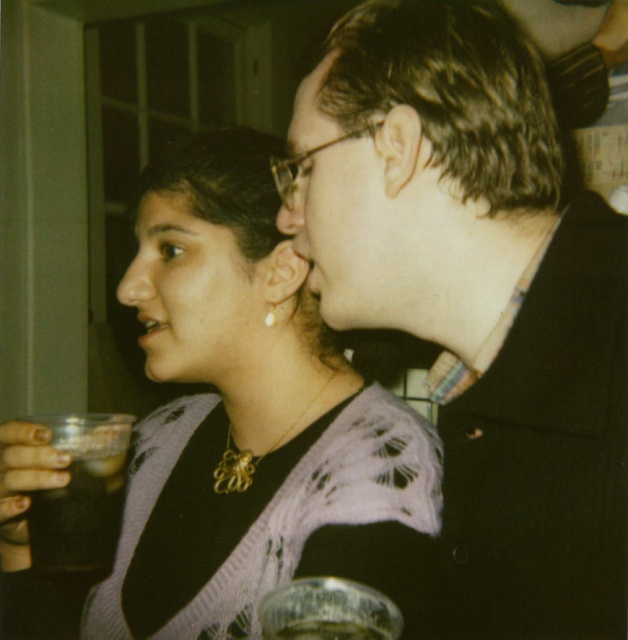
You are a photographer trying to capture a closeup of the gold metallic earring at upper left without the transparent plastic wine glass at lower center appearing in the frame. Is this possible based on their positions?

The transparent plastic wine glass at lower center is positioned under the gold metallic earring at upper left, so if you aim your camera to focus on the gold metallic earring at upper left, the wine glass at lower center will be below it and might not obstruct the view. However, since the earring is at upper left and the glass is lower, it should be possible to frame the shot without the glass overlapping the earring.

From the picture: You are standing in the room and need to find the matte black glasses at center. According to the scene description, where exactly are they positioned?

The matte black glasses at center are located at point coordinates of (333, 205).